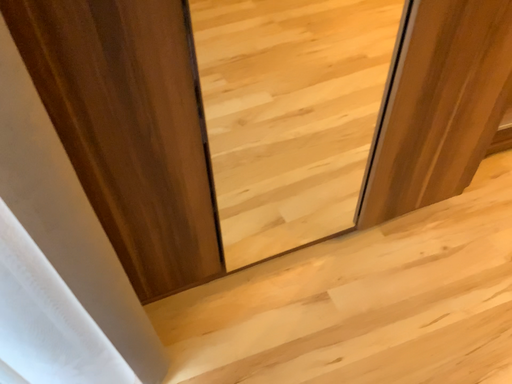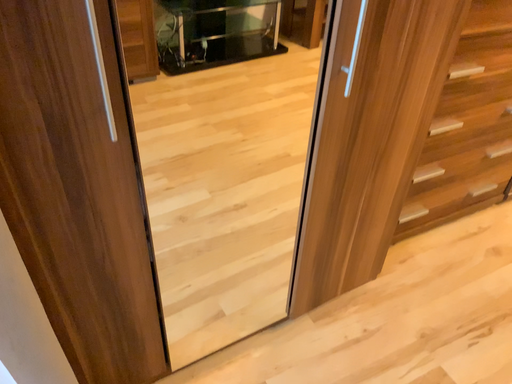
Question: How did the camera likely rotate when shooting the video?

Choices:
 (A) rotated right
 (B) rotated left

Answer: (A)